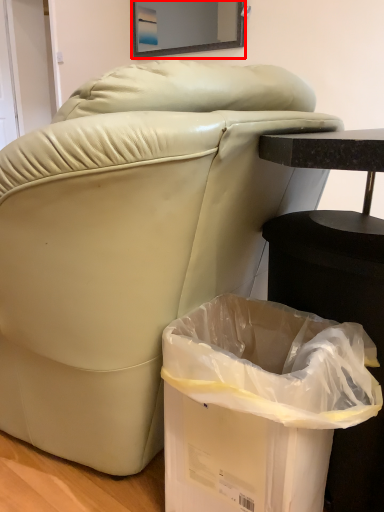
Question: From the image's perspective, where is mirror (annotated by the red box) located in relation to trash bin/can in the image?

Choices:
 (A) above
 (B) below

Answer: (A)